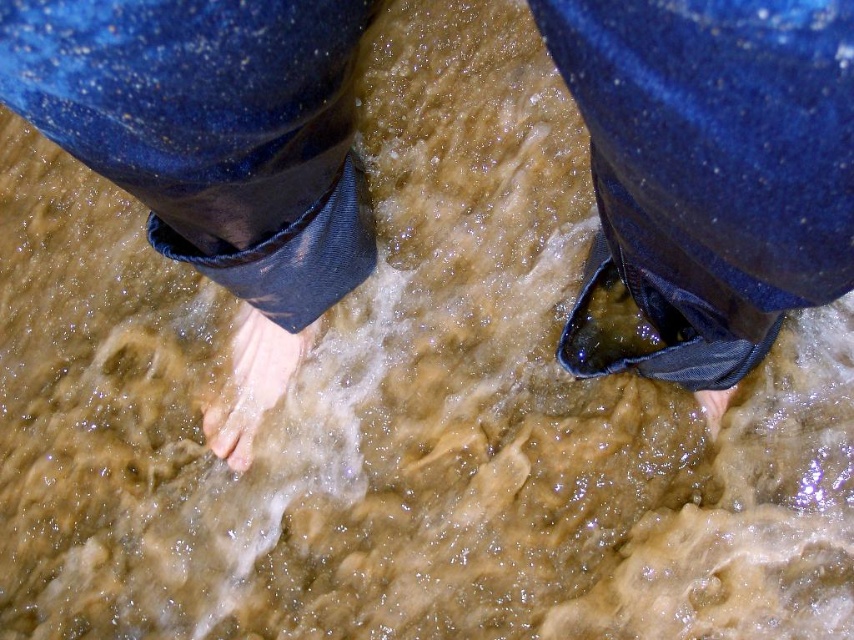
Does denim at lower left appear on the left side of pale skin/soft flesh at lower center?

In fact, denim at lower left is to the right of pale skin/soft flesh at lower center.

Is denim at lower left above pale skin/soft flesh at lower center?

Yes.

Is point (79, 129) in front of point (264, 364)?

Yes, it is in front of point (264, 364).

At what (x,y) coordinates should I click in order to perform the action: click on denim at lower left. Please return your answer as a coordinate pair (x, y). The height and width of the screenshot is (640, 854). Looking at the image, I should click on (211, 131).

Which is in front, point (705, 19) or point (205, 195)?

Point (705, 19) is more forward.

Does point (606, 3) come closer to viewer compared to point (168, 154)?

That is True.

The image size is (854, 640). Identify the location of denim at lower right. (x=712, y=168).

Between point (722, 296) and point (724, 408), which one is positioned behind?

Positioned behind is point (724, 408).

Does denim at lower right appear on the right side of matte skin toe at lower center?

In fact, denim at lower right is to the left of matte skin toe at lower center.

What do you see at coordinates (712, 168) in the screenshot? The width and height of the screenshot is (854, 640). I see `denim at lower right` at bounding box center [712, 168].

Where is `denim at lower right`? Image resolution: width=854 pixels, height=640 pixels. denim at lower right is located at coordinates point(712,168).